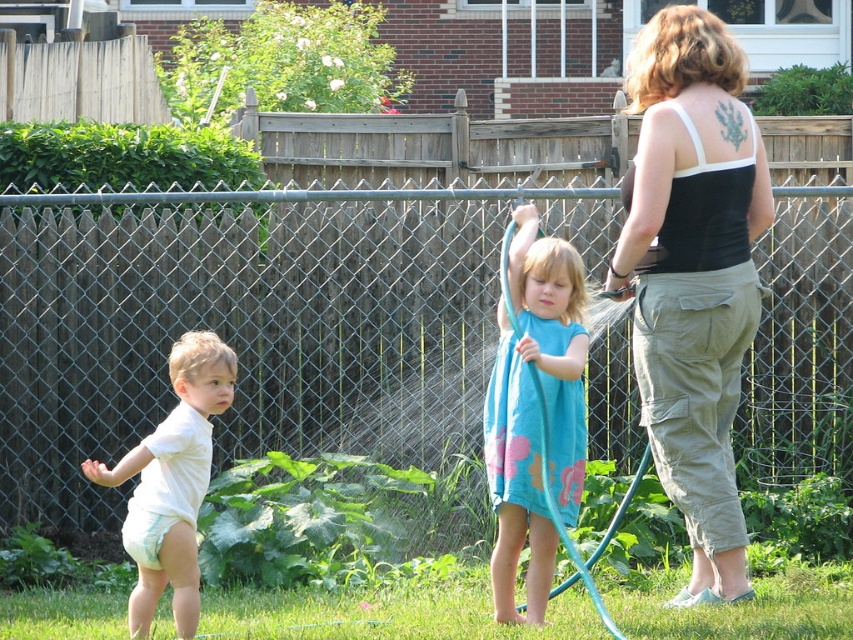
Is black tank top at upper right to the left of white cotton shirt at left from the viewer's perspective?

In fact, black tank top at upper right is to the right of white cotton shirt at left.

Does point (682, 472) come behind point (222, 372)?

Yes, point (682, 472) is behind point (222, 372).

The height and width of the screenshot is (640, 853). Identify the location of black tank top at upper right. (693, 275).

Can you confirm if black tank top at upper right is wider than blue rubber hose at center?

No, black tank top at upper right is not wider than blue rubber hose at center.

Between black tank top at upper right and blue rubber hose at center, which one appears on the right side from the viewer's perspective?

From the viewer's perspective, black tank top at upper right appears more on the right side.

Does point (701, 420) lie in front of point (635, 481)?

Yes, point (701, 420) is in front of point (635, 481).

The image size is (853, 640). Identify the location of black tank top at upper right. (693, 275).

Measure the distance between white cotton shirt at left and blue rubber hose at center.

white cotton shirt at left and blue rubber hose at center are 4.42 feet apart.

Does white cotton shirt at left come behind blue rubber hose at center?

Yes, white cotton shirt at left is further from the viewer.

Image resolution: width=853 pixels, height=640 pixels. What are the coordinates of `white cotton shirt at left` in the screenshot? It's located at (172, 483).